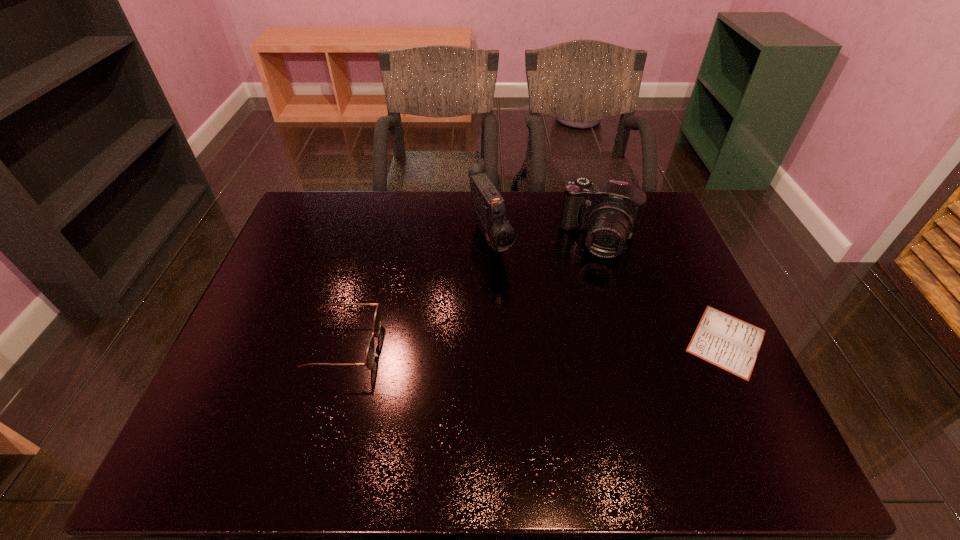
Where is `object present at the far right corner`? The height and width of the screenshot is (540, 960). object present at the far right corner is located at coordinates (610, 211).

You are a GUI agent. You are given a task and a screenshot of the screen. Output one action in this format:
    pyautogui.click(x=<x>, y=<y>)
    Task: Click on the vacant space at the far edge of the desktop
    The height and width of the screenshot is (540, 960).
    Given the screenshot: What is the action you would take?
    (384, 217)

Locate an element on the screen. This screenshot has width=960, height=540. free space at the near edge of the desktop is located at coordinates (538, 412).

In the image, there is a desktop. Identify the location of vacant space at the left edge. The image size is (960, 540). (329, 251).

You are a GUI agent. You are given a task and a screenshot of the screen. Output one action in this format:
    pyautogui.click(x=<x>, y=<y>)
    Task: Click on the free space at the right edge
    
    Given the screenshot: What is the action you would take?
    pyautogui.click(x=692, y=336)

Locate an element on the screen. The height and width of the screenshot is (540, 960). vacant space at the far left corner is located at coordinates (299, 219).

Image resolution: width=960 pixels, height=540 pixels. In the image, there is a desktop. Find the location of `vacant space at the far right corner`. vacant space at the far right corner is located at coordinates (651, 193).

In the image, there is a desktop. Where is `blank space at the near right corner`? blank space at the near right corner is located at coordinates (694, 414).

At what (x,y) coordinates should I click in order to perform the action: click on vacant space that's between the diary and the spectacles. Please return your answer as a coordinate pair (x, y). Looking at the image, I should click on (536, 344).

Locate an element on the screen. The width and height of the screenshot is (960, 540). vacant space that is in between the third object from right to left and the camera is located at coordinates (545, 239).